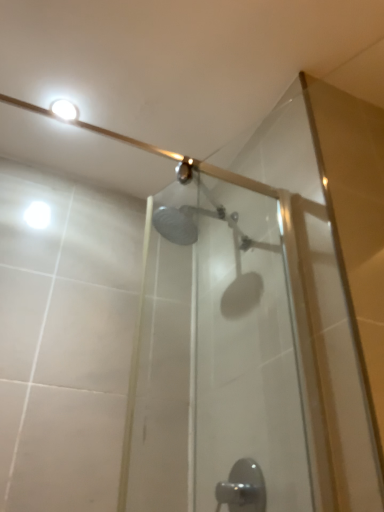
Question: Is satin nickel faucet at lower center outside of white glossy light fixture at upper left?

Choices:
 (A) no
 (B) yes

Answer: (B)

Question: From the image's perspective, is satin nickel faucet at lower center below white glossy light fixture at upper left?

Choices:
 (A) no
 (B) yes

Answer: (B)

Question: Is satin nickel faucet at lower center oriented away from white glossy light fixture at upper left?

Choices:
 (A) no
 (B) yes

Answer: (A)

Question: Could white glossy light fixture at upper left be considered to be inside satin nickel faucet at lower center?

Choices:
 (A) yes
 (B) no

Answer: (B)

Question: Is the position of satin nickel faucet at lower center more distant than that of white glossy light fixture at upper left?

Choices:
 (A) yes
 (B) no

Answer: (B)

Question: From the image's perspective, would you say satin nickel faucet at lower center is positioned over white glossy light fixture at upper left?

Choices:
 (A) no
 (B) yes

Answer: (A)

Question: Is white glossy light fixture at upper left facing away from satin nickel faucet at lower center?

Choices:
 (A) yes
 (B) no

Answer: (B)

Question: Is satin nickel faucet at lower center located within white glossy light fixture at upper left?

Choices:
 (A) yes
 (B) no

Answer: (B)

Question: From a real-world perspective, is white glossy light fixture at upper left below satin nickel faucet at lower center?

Choices:
 (A) no
 (B) yes

Answer: (A)

Question: Can you confirm if white glossy light fixture at upper left is positioned to the left of satin nickel faucet at lower center?

Choices:
 (A) yes
 (B) no

Answer: (A)

Question: Considering the relative sizes of white glossy light fixture at upper left and satin nickel faucet at lower center in the image provided, is white glossy light fixture at upper left shorter than satin nickel faucet at lower center?

Choices:
 (A) yes
 (B) no

Answer: (A)

Question: Is white glossy light fixture at upper left closer to the viewer compared to satin nickel faucet at lower center?

Choices:
 (A) no
 (B) yes

Answer: (A)

Question: Considering their positions, is white glossy light fixture at upper left located in front of or behind satin nickel faucet at lower center?

Choices:
 (A) front
 (B) behind

Answer: (B)